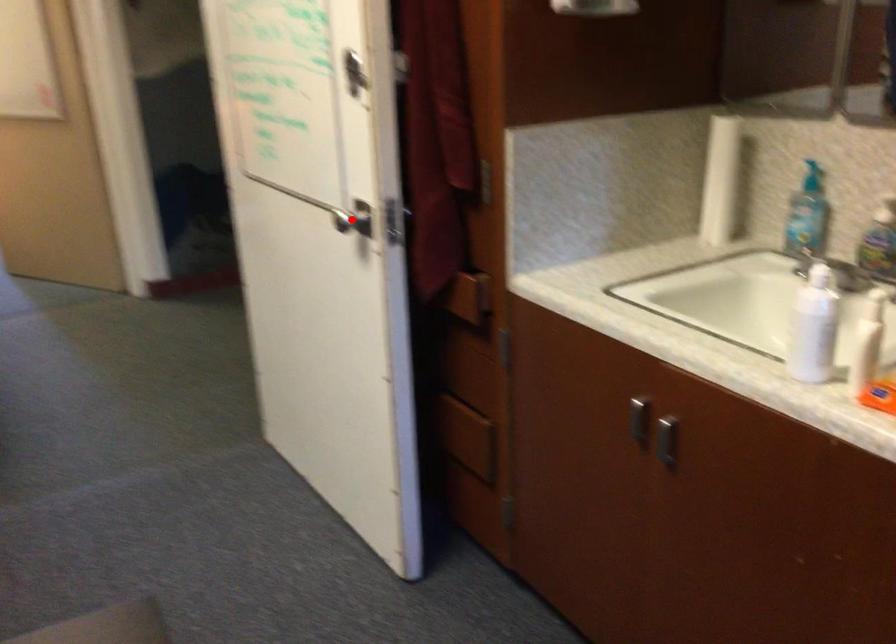
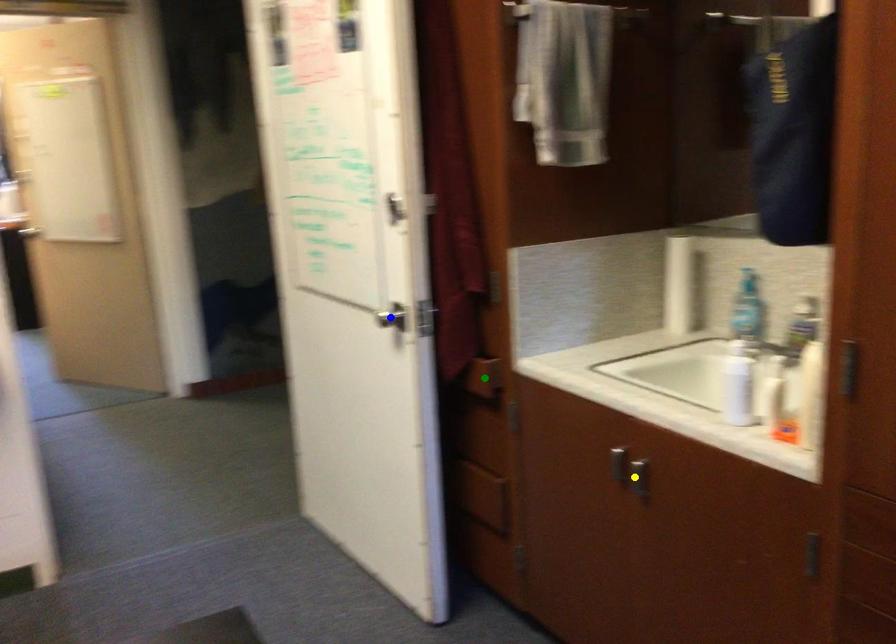
Question: I am providing you with two images of the same scene from different viewpoints. A red point is marked on the first image. You are given multiple points on the second image. Which mark in image 2 goes with the point in image 1?

Choices:
 (A) yellow point
 (B) green point
 (C) blue point

Answer: (C)